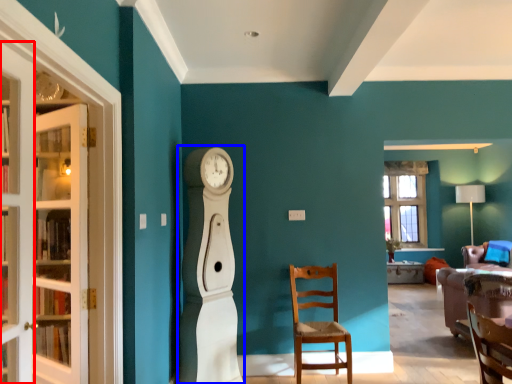
Question: Which point is closer to the camera, door (highlighted by a red box) or open (highlighted by a blue box)?

Choices:
 (A) door
 (B) open

Answer: (A)